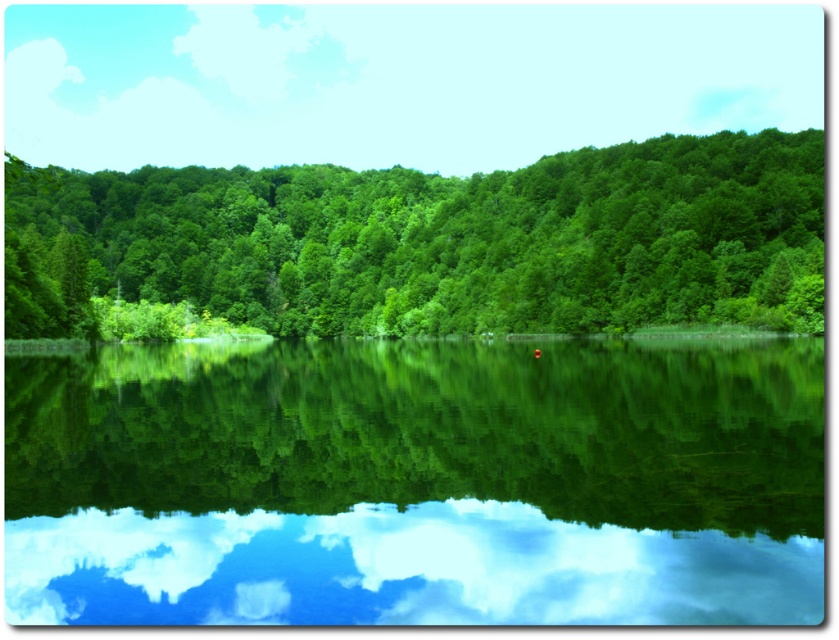
Who is lower down, green reflective water at center or green leafy trees at center?

green reflective water at center

Is point (90, 552) positioned in front of point (314, 272)?

Yes, point (90, 552) is closer to viewer.

This screenshot has height=640, width=839. What do you see at coordinates (415, 483) in the screenshot? I see `green reflective water at center` at bounding box center [415, 483].

Find the location of a particular element. The height and width of the screenshot is (640, 839). green reflective water at center is located at coordinates (415, 483).